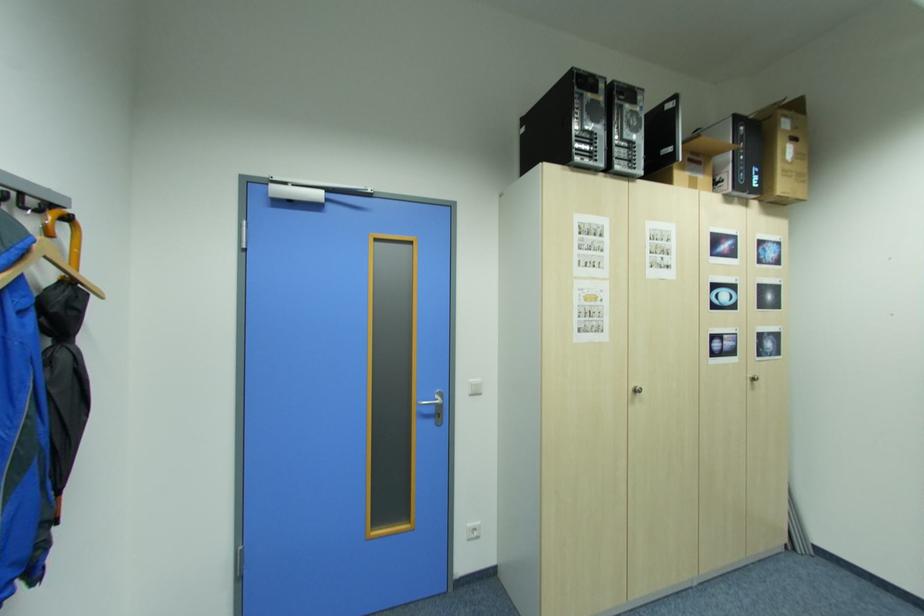
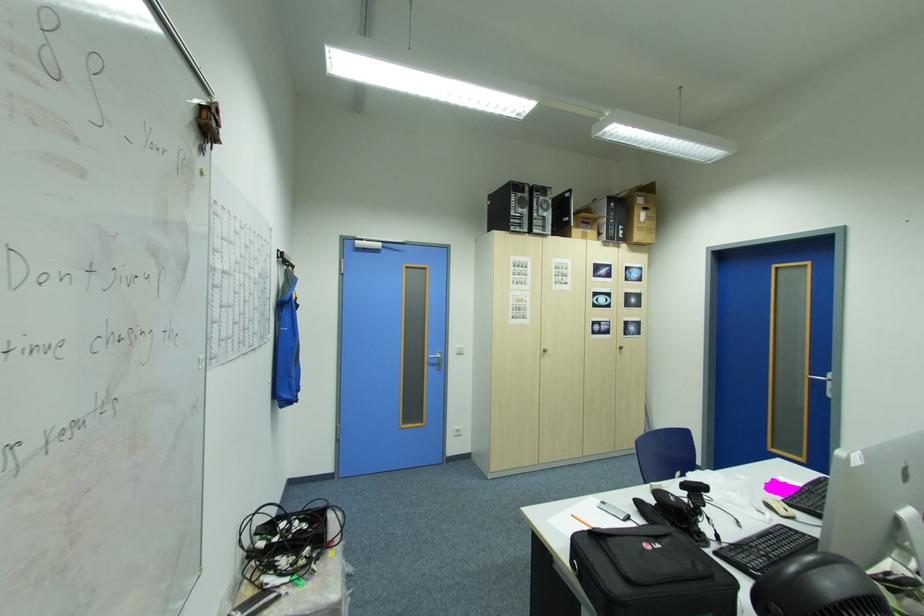
Where in the second image is the point corresponding to (x=793, y=116) from the first image?

(648, 198)